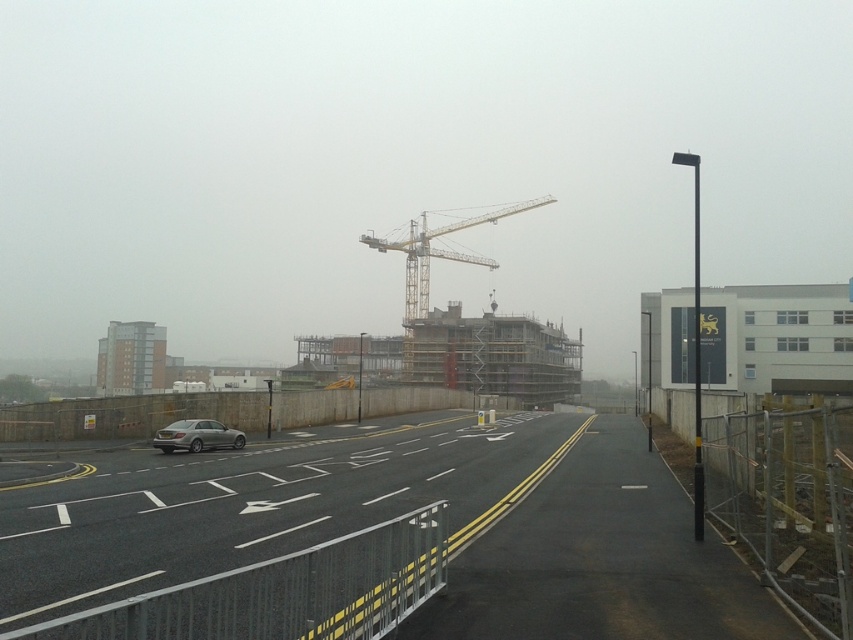
Does yellow metallic crane at center lie behind satin silver sedan at center?

Yes, yellow metallic crane at center is behind satin silver sedan at center.

Can you confirm if yellow metallic crane at center is positioned above satin silver sedan at center?

Yes, yellow metallic crane at center is above satin silver sedan at center.

Which is behind, point (447, 253) or point (178, 424)?

The point (447, 253) is more distant.

This screenshot has width=853, height=640. What are the coordinates of `yellow metallic crane at center` in the screenshot? It's located at (437, 252).

Between dark asphalt highway at center and satin silver sedan at center, which one has more height?

With more height is dark asphalt highway at center.

Is dark asphalt highway at center closer to the viewer compared to satin silver sedan at center?

Yes, it is.

Is point (167, 493) less distant than point (177, 442)?

Yes, it is.

Locate an element on the screen. This screenshot has height=640, width=853. dark asphalt highway at center is located at coordinates (447, 540).

Which is behind, point (729, 616) or point (424, 230)?

The point (424, 230) is behind.

Is dark asphalt highway at center taller than yellow metallic crane at center?

Incorrect, dark asphalt highway at center's height is not larger of yellow metallic crane at center's.

Find the location of a particular element. This screenshot has width=853, height=640. dark asphalt highway at center is located at coordinates (447, 540).